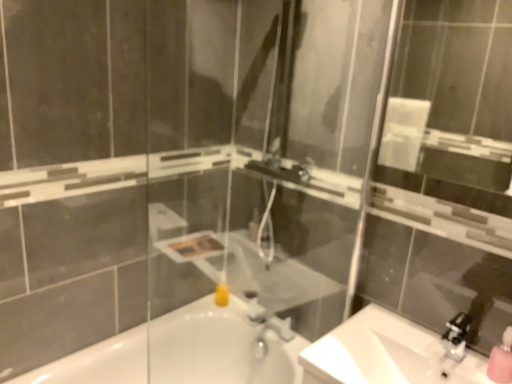
Question: From a real-world perspective, is matte silver faucet at center physically below pink matte soap dispenser at lower right?

Choices:
 (A) yes
 (B) no

Answer: (A)

Question: Is matte silver faucet at center far away from pink matte soap dispenser at lower right?

Choices:
 (A) yes
 (B) no

Answer: (B)

Question: Could you tell me if matte silver faucet at center is facing pink matte soap dispenser at lower right?

Choices:
 (A) yes
 (B) no

Answer: (B)

Question: Does matte silver faucet at center come behind pink matte soap dispenser at lower right?

Choices:
 (A) yes
 (B) no

Answer: (A)

Question: Is matte silver faucet at center facing away from pink matte soap dispenser at lower right?

Choices:
 (A) no
 (B) yes

Answer: (A)

Question: Can you confirm if matte silver faucet at center is taller than pink matte soap dispenser at lower right?

Choices:
 (A) no
 (B) yes

Answer: (A)

Question: Considering the relative sizes of white glossy sink at lower right and satin nickel faucet at lower right in the image provided, is white glossy sink at lower right bigger than satin nickel faucet at lower right?

Choices:
 (A) no
 (B) yes

Answer: (B)

Question: Is white glossy sink at lower right positioned before satin nickel faucet at lower right?

Choices:
 (A) no
 (B) yes

Answer: (B)

Question: Does white glossy sink at lower right appear on the right side of satin nickel faucet at lower right?

Choices:
 (A) yes
 (B) no

Answer: (B)

Question: From the image's perspective, does white glossy sink at lower right appear higher than satin nickel faucet at lower right?

Choices:
 (A) yes
 (B) no

Answer: (B)

Question: Considering the relative sizes of white glossy sink at lower right and satin nickel faucet at lower right in the image provided, is white glossy sink at lower right thinner than satin nickel faucet at lower right?

Choices:
 (A) no
 (B) yes

Answer: (A)

Question: From a real-world perspective, is white glossy sink at lower right under satin nickel faucet at lower right?

Choices:
 (A) yes
 (B) no

Answer: (A)

Question: From the image's perspective, would you say white glossy sink at lower right is shown under clear glass mirror at upper center?

Choices:
 (A) no
 (B) yes

Answer: (B)